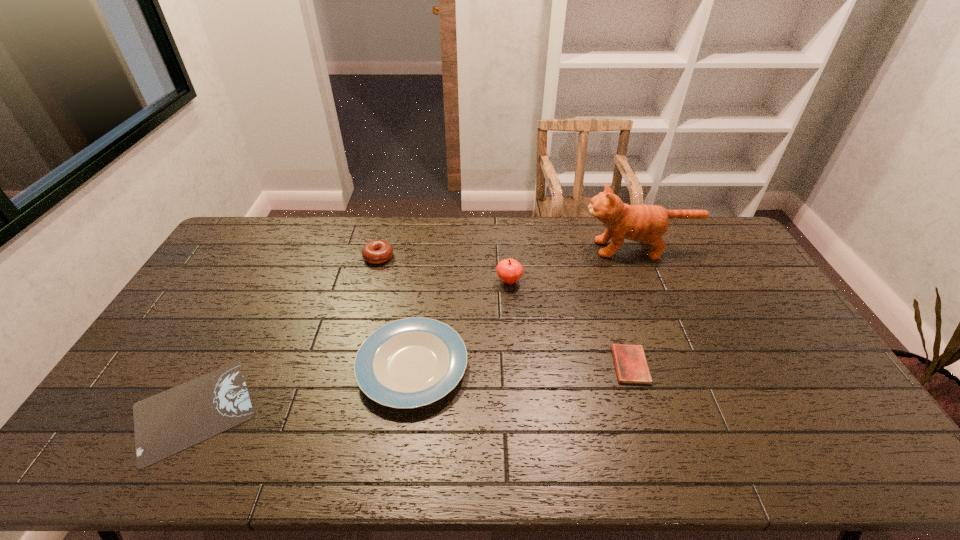
Find the location of a particular element. The height and width of the screenshot is (540, 960). free spot between the doughnut and the apple is located at coordinates (444, 269).

Locate an element on the screen. The image size is (960, 540). free spot between the third shortest object and the fifth tallest object is located at coordinates (521, 366).

Locate an element on the screen. The height and width of the screenshot is (540, 960). empty space between the shortest object and the plate is located at coordinates (303, 389).

I want to click on free space between the fifth tallest object and the apple, so click(x=569, y=323).

What are the coordinates of `free spot between the third tallest object and the diary` in the screenshot? It's located at (504, 311).

You are a GUI agent. You are given a task and a screenshot of the screen. Output one action in this format:
    pyautogui.click(x=<x>, y=<y>)
    Task: Click on the unoccupied area between the apple and the leftmost object
    The width and height of the screenshot is (960, 540).
    Given the screenshot: What is the action you would take?
    pyautogui.click(x=351, y=346)

Locate an element on the screen. free space between the fourth tallest object and the second tallest object is located at coordinates (461, 324).

What are the coordinates of `the closest object to the fourth nearest object` in the screenshot? It's located at (412, 362).

Locate which object ranks in proximity to the cat. Please provide its 2D coordinates. Your answer should be formatted as a tuple, i.e. [(x, y)], where the tuple contains the x and y coordinates of a point satisfying the conditions above.

[(509, 271)]

This screenshot has width=960, height=540. Find the location of `free point that satisfies the following two spatial constraints: 1. on the face of the cat; 2. on the front side of the fourth shortest object`. free point that satisfies the following two spatial constraints: 1. on the face of the cat; 2. on the front side of the fourth shortest object is located at coordinates (641, 256).